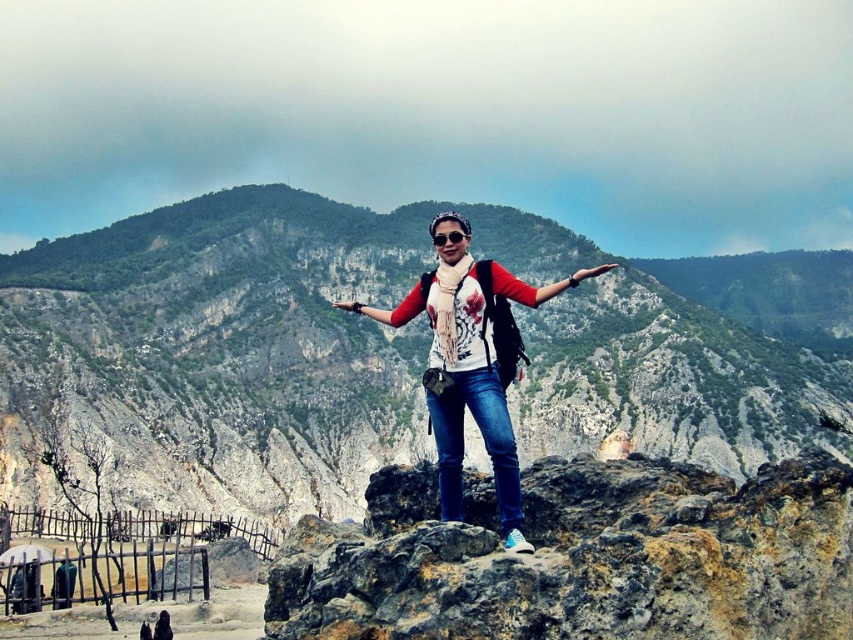
Does white printed shirt at center appear under transparent plastic goggles at center?

Correct, white printed shirt at center is located below transparent plastic goggles at center.

Between white printed shirt at center and transparent plastic goggles at center, which one appears on the left side from the viewer's perspective?

From the viewer's perspective, transparent plastic goggles at center appears more on the left side.

Which is in front, point (473, 394) or point (454, 236)?

Point (473, 394) is in front.

Find the location of a particular element. white printed shirt at center is located at coordinates (469, 365).

Which is behind, point (376, 346) or point (389, 620)?

The point (376, 346) is behind.

In the scene shown: Is rocky terrain at center positioned behind brown rocky outcrop at center?

Yes, rocky terrain at center is further from the viewer.

Is point (181, 296) closer to viewer compared to point (827, 465)?

No.

Locate an element on the screen. The width and height of the screenshot is (853, 640). rocky terrain at center is located at coordinates (230, 346).

Is brown rocky outcrop at center above white printed shirt at center?

Actually, brown rocky outcrop at center is below white printed shirt at center.

Is brown rocky outcrop at center positioned before white printed shirt at center?

Yes, it is in front of white printed shirt at center.

Is point (422, 608) more distant than point (462, 422)?

No, (422, 608) is closer to viewer.

Find the location of `brown rocky outcrop at center`. brown rocky outcrop at center is located at coordinates (581, 557).